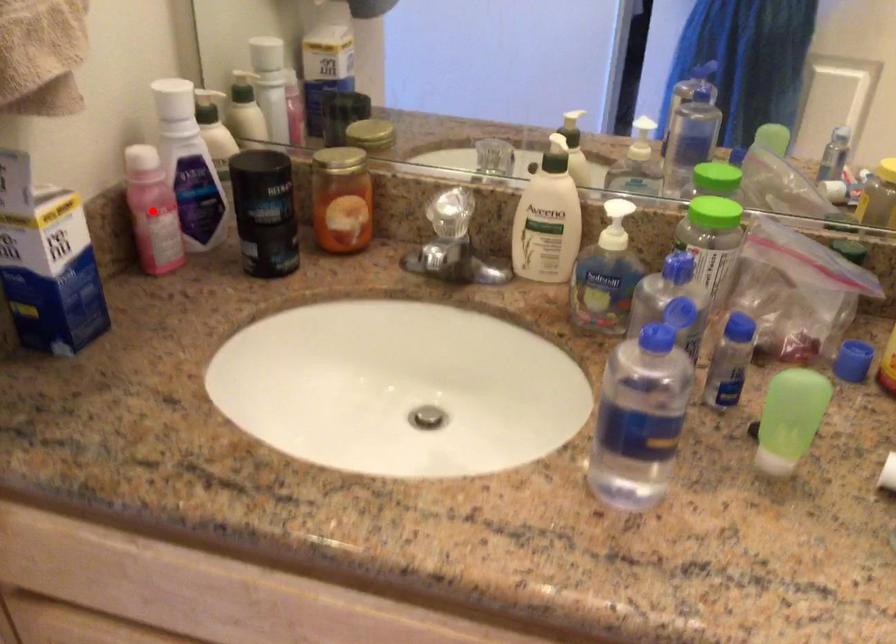
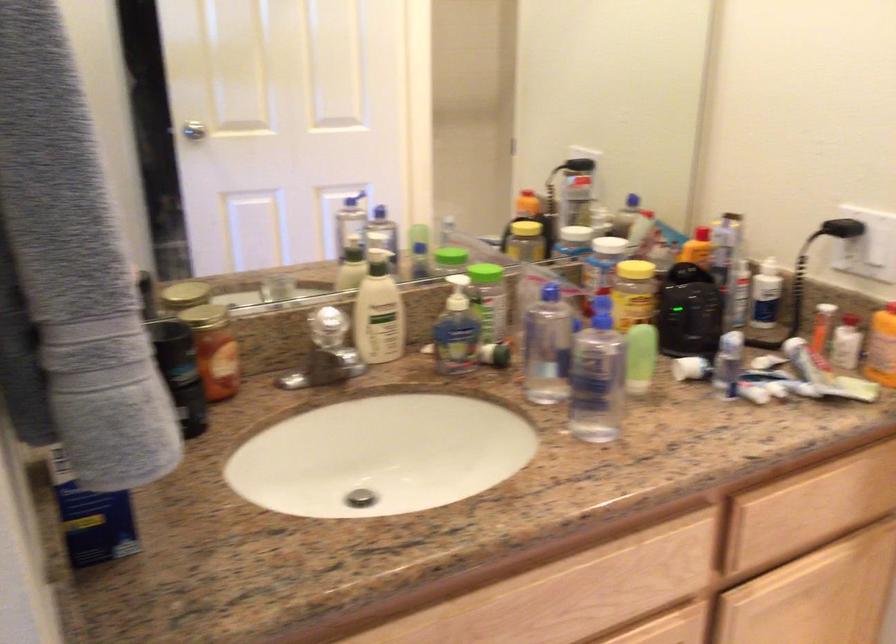
Question: I am providing you with two images of the same scene from different viewpoints. A red point is marked on the first image. Can you still see the location of the red point in image 2?

Choices:
 (A) Yes
 (B) No

Answer: (B)